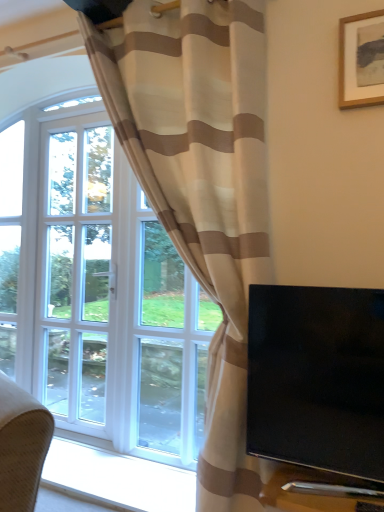
Question: Is wooden picture frame at upper right inside the boundaries of white glass screen door at left, or outside?

Choices:
 (A) outside
 (B) inside

Answer: (A)

Question: Is wooden picture frame at upper right bigger or smaller than white glass screen door at left?

Choices:
 (A) small
 (B) big

Answer: (A)

Question: Considering the real-world distances, which object is closest to the black glossy tv at right?

Choices:
 (A) white glass screen door at left
 (B) beige striped curtain at left
 (C) wooden picture frame at upper right

Answer: (B)

Question: Which object is the closest to the beige striped curtain at left?

Choices:
 (A) wooden picture frame at upper right
 (B) white glass screen door at left
 (C) black glossy tv at right

Answer: (C)